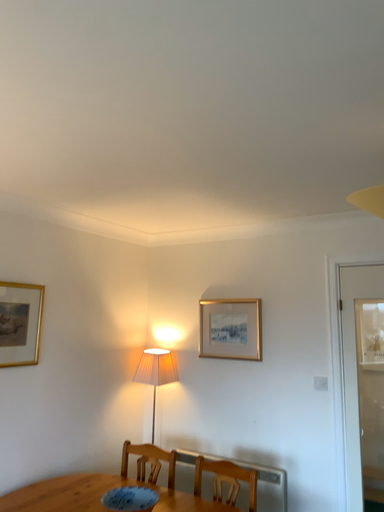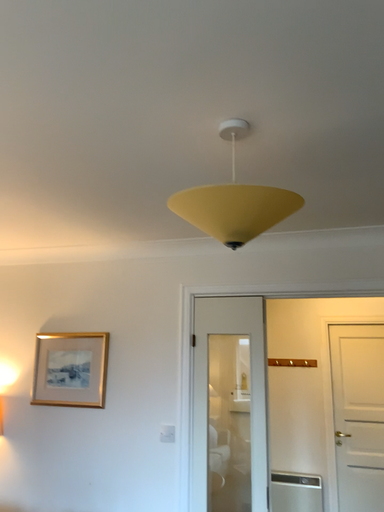
Question: How did the camera likely rotate when shooting the video?

Choices:
 (A) rotated right
 (B) rotated left

Answer: (A)